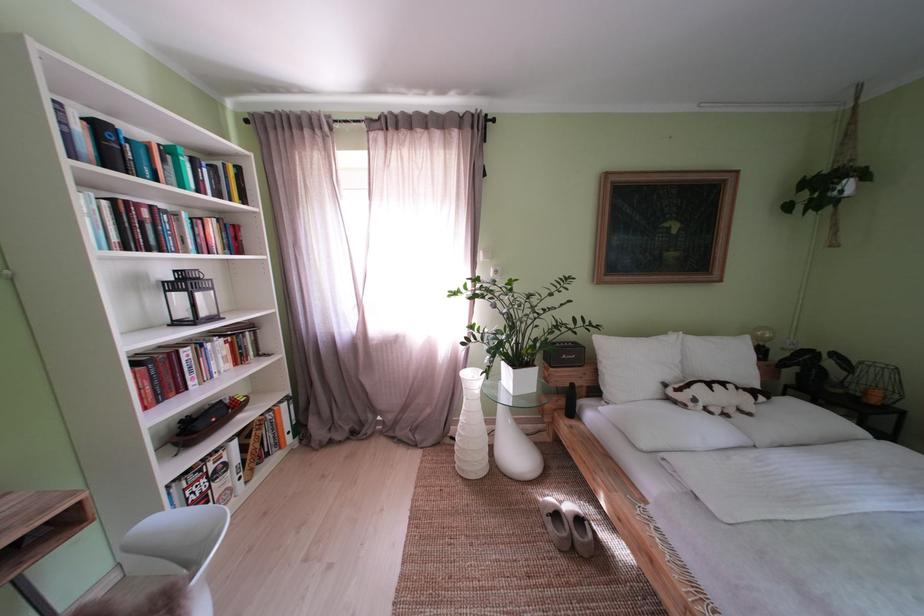
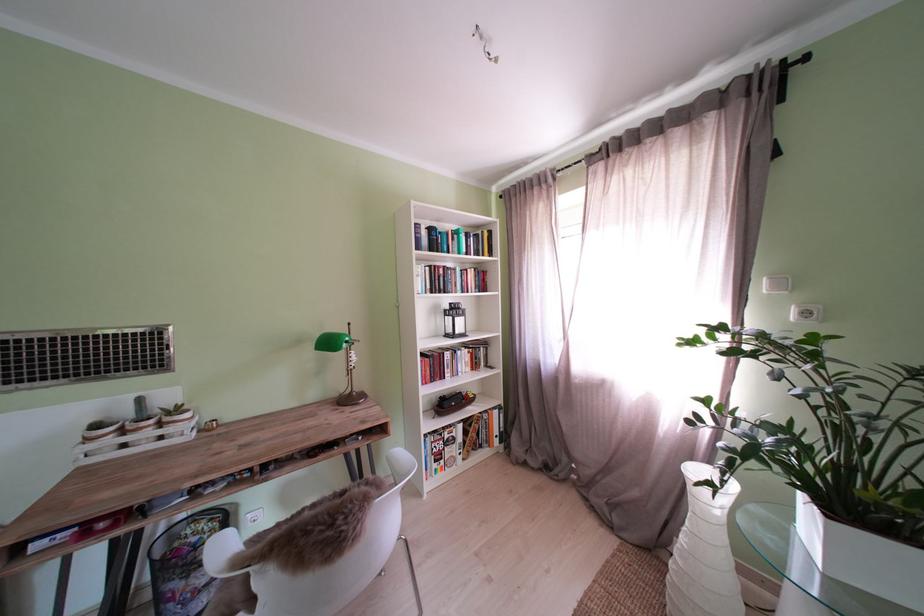
Find the pixel in the second image that matches the point at 507,277 in the first image.

(818, 318)